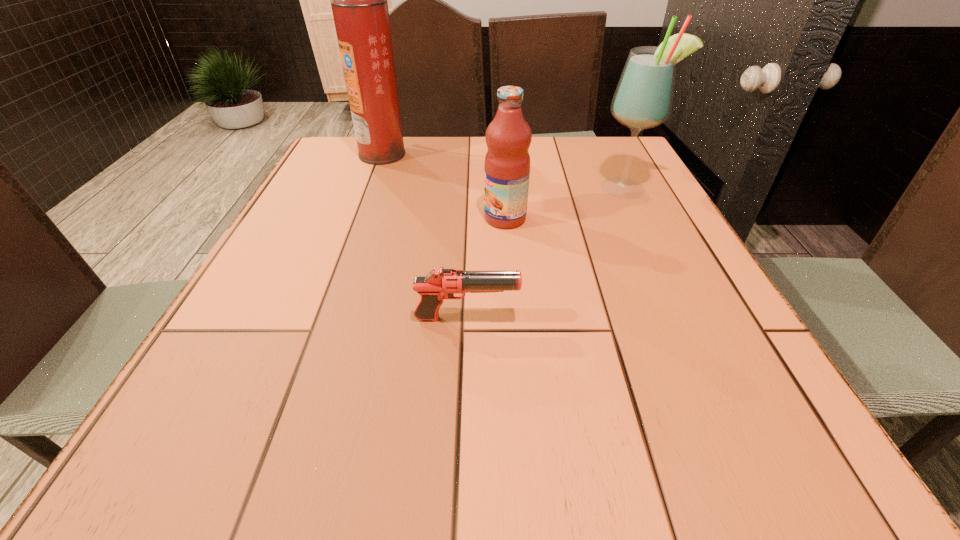
Find the location of a particular element. This screenshot has height=540, width=960. the leftmost object is located at coordinates (359, 0).

Locate an element on the screen. The width and height of the screenshot is (960, 540). the farthest object is located at coordinates click(x=359, y=0).

Identify the location of the second tallest object. The image size is (960, 540). (643, 99).

The width and height of the screenshot is (960, 540). I want to click on the second farthest object, so click(x=643, y=99).

I want to click on fruit juice, so click(x=508, y=137).

Where is `the second shortest object`? The image size is (960, 540). the second shortest object is located at coordinates (508, 137).

This screenshot has width=960, height=540. Identify the location of the nearest object. (441, 283).

Image resolution: width=960 pixels, height=540 pixels. Find the location of `the shortest object`. the shortest object is located at coordinates (441, 283).

What are the coordinates of `vacant space located 0.250m at the nozzle of the tallest object` in the screenshot? It's located at (491, 154).

Where is `blank area located on the back of the rightmost object`? Image resolution: width=960 pixels, height=540 pixels. blank area located on the back of the rightmost object is located at coordinates (609, 154).